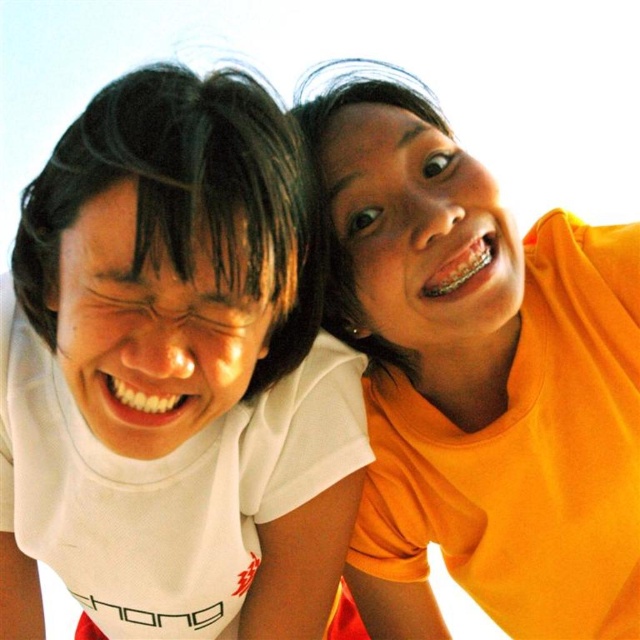
Question: Does white matte t-shirt at upper left have a greater width compared to orange matte shirt at upper right?

Choices:
 (A) no
 (B) yes

Answer: (B)

Question: Which point appears farthest from the camera in this image?

Choices:
 (A) (250, 580)
 (B) (394, 588)

Answer: (B)

Question: Does white matte t-shirt at upper left have a lesser width compared to orange matte shirt at upper right?

Choices:
 (A) yes
 (B) no

Answer: (B)

Question: Among these objects, which one is nearest to the camera?

Choices:
 (A) orange matte shirt at upper right
 (B) white matte t-shirt at upper left

Answer: (B)

Question: Is white matte t-shirt at upper left positioned at the back of orange matte shirt at upper right?

Choices:
 (A) yes
 (B) no

Answer: (B)